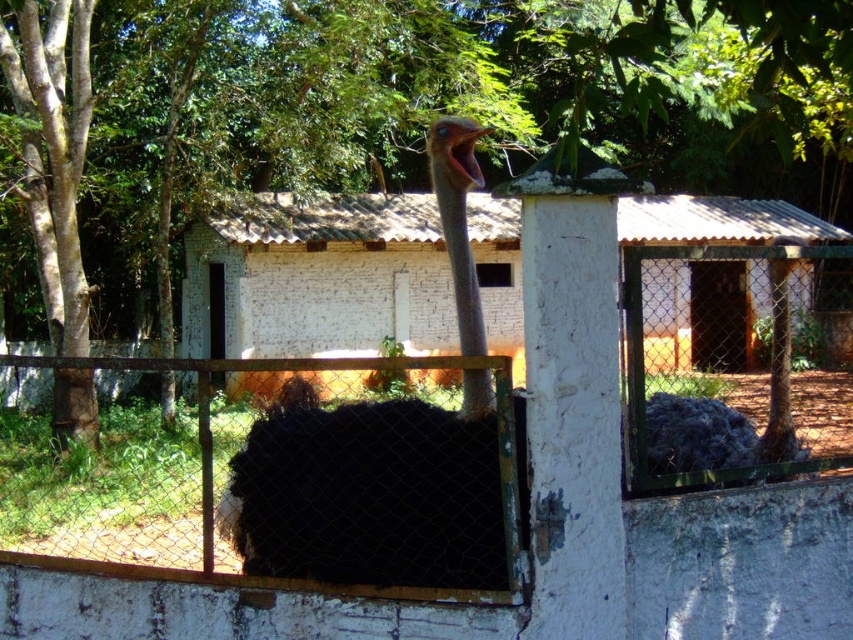
Question: Which point is closer to the camera taking this photo?

Choices:
 (A) (729, 209)
 (B) (331, 454)
 (C) (808, 129)

Answer: (B)

Question: Which point is closer to the camera taking this photo?

Choices:
 (A) (61, 12)
 (B) (405, 516)
 (C) (328, 237)

Answer: (B)

Question: Which point is farther to the camera?

Choices:
 (A) white brick hut at center
 (B) black feathered ostrich at center
 (C) green leafy tree at upper center

Answer: (B)

Question: Is white brick hut at center to the right of black feathered ostrich at center from the viewer's perspective?

Choices:
 (A) no
 (B) yes

Answer: (B)

Question: In this image, where is green leafy tree at upper center located relative to black feathered ostrich at center?

Choices:
 (A) above
 (B) below

Answer: (A)

Question: Is green leafy tree at upper center below black feathered ostrich at center?

Choices:
 (A) yes
 (B) no

Answer: (B)